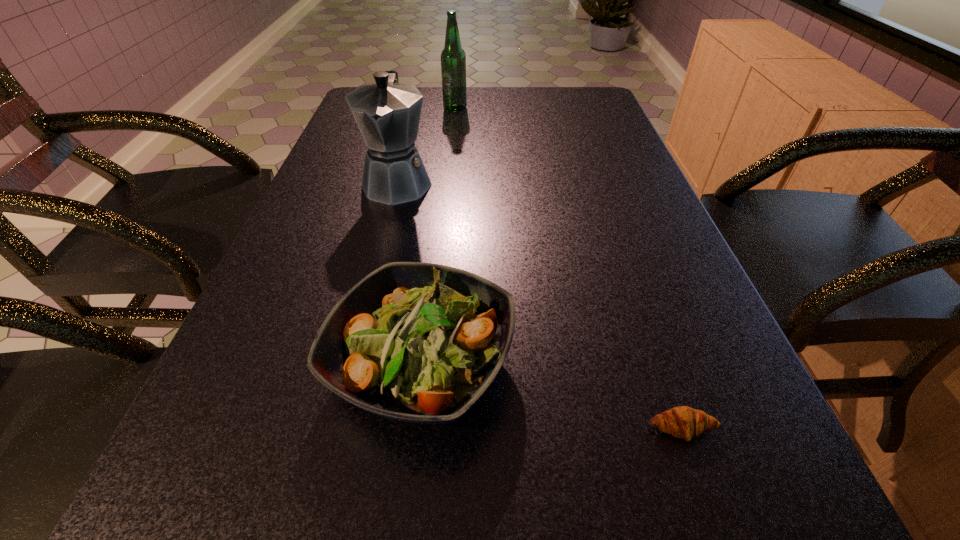
I want to click on coffeepot that is at the left edge, so click(x=387, y=113).

Where is `salad plate that is at the left edge`? salad plate that is at the left edge is located at coordinates (417, 342).

The height and width of the screenshot is (540, 960). I want to click on object present at the right edge, so click(x=684, y=422).

At what (x,y) coordinates should I click in order to perform the action: click on free space at the far edge of the desktop. Please return your answer as a coordinate pair (x, y). This screenshot has width=960, height=540. Looking at the image, I should click on (483, 108).

In the image, there is a desktop. Where is `vacant space at the left edge`? Image resolution: width=960 pixels, height=540 pixels. vacant space at the left edge is located at coordinates (216, 373).

In order to click on blank area at the right edge in this screenshot , I will do `click(615, 184)`.

Where is `free space at the far right corner of the desktop`? This screenshot has width=960, height=540. free space at the far right corner of the desktop is located at coordinates (593, 104).

The image size is (960, 540). Identify the location of free spot between the third tallest object and the farthest object. (439, 235).

You are a GUI agent. You are given a task and a screenshot of the screen. Output one action in this format:
    pyautogui.click(x=<x>, y=<y>)
    Task: Click on the vacant area between the rightmost object and the third nearest object
    The image size is (960, 540).
    Given the screenshot: What is the action you would take?
    pyautogui.click(x=540, y=305)

At what (x,y) coordinates should I click in order to perform the action: click on free point between the coffeepot and the shortest object. Please return your answer as a coordinate pair (x, y). This screenshot has height=540, width=960. Looking at the image, I should click on (540, 305).